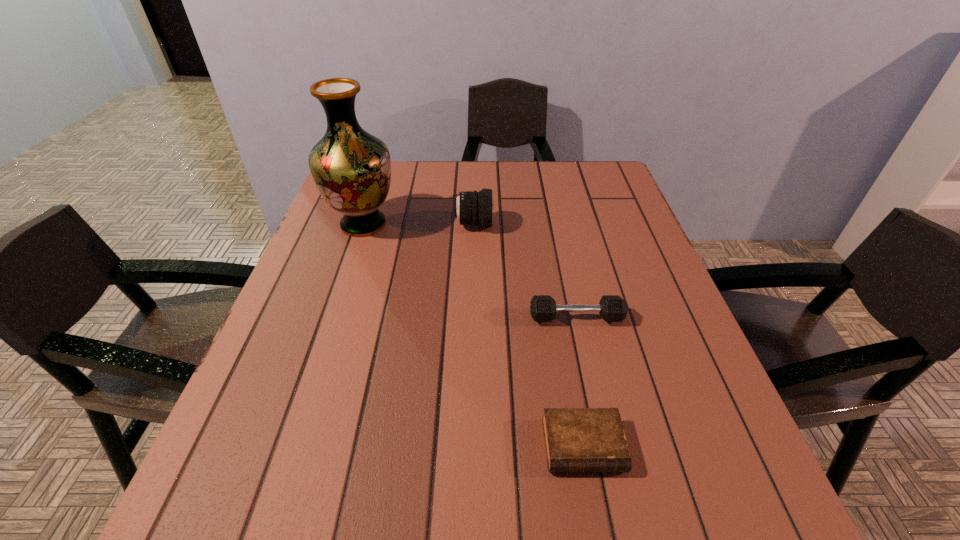
Identify the location of object identified as the third closest to the shortest object. Image resolution: width=960 pixels, height=540 pixels. pos(351,168).

Locate an element on the screen. Image resolution: width=960 pixels, height=540 pixels. vacant area in the image that satisfies the following two spatial constraints: 1. on the front side of the dumbbell; 2. on the left side of the tallest object is located at coordinates (332, 318).

At what (x,y) coordinates should I click in order to perform the action: click on free location that satisfies the following two spatial constraints: 1. at the front element of the dumbbell; 2. on the left side of the third shortest object. Please return your answer as a coordinate pair (x, y). The height and width of the screenshot is (540, 960). Looking at the image, I should click on click(x=472, y=318).